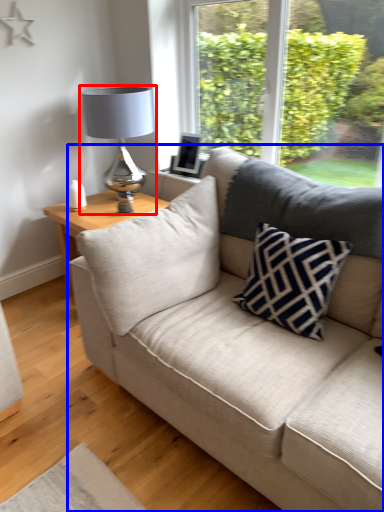
Question: Which object is closer to the camera taking this photo, table lamp (highlighted by a red box) or studio couch (highlighted by a blue box)?

Choices:
 (A) table lamp
 (B) studio couch

Answer: (B)